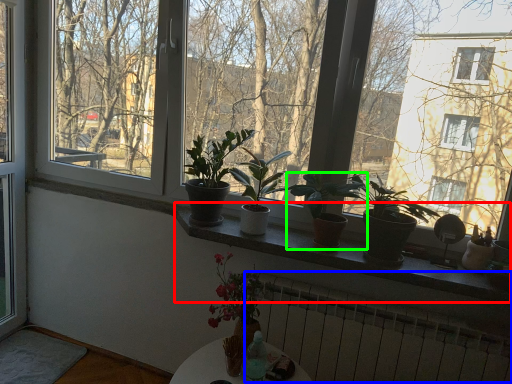
Question: Which object is the farthest from window sill (highlighted by a red box)? Choose among these: radiator (highlighted by a blue box) or houseplant (highlighted by a green box).

Choices:
 (A) radiator
 (B) houseplant

Answer: (A)